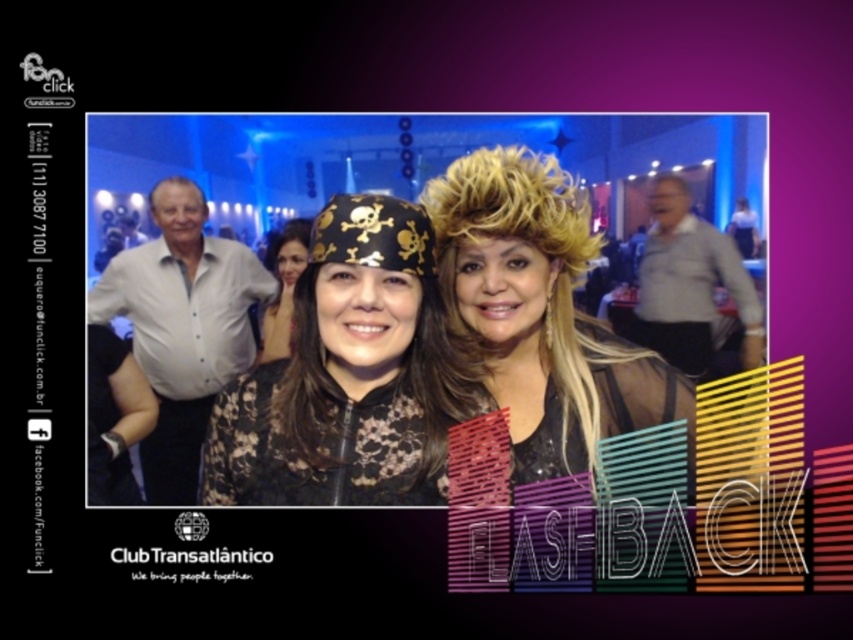
You are at a party and want to find the white cotton shirt at left and the matte black headscarf at center. Which one is taller?

The white cotton shirt at left is taller than the matte black headscarf at center.

You are standing at the entrance of Club Transatlantico and want to find the white cotton shirt at left. According to the image, where exactly is it positioned?

The white cotton shirt at left is located at point (183,326).